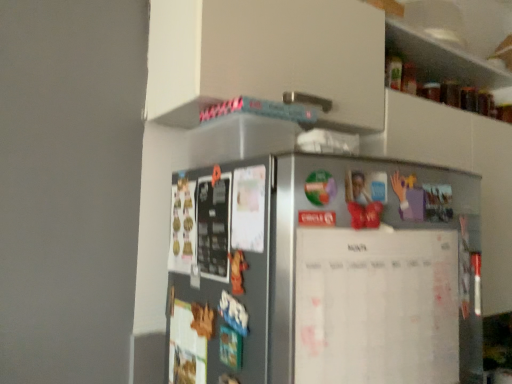
Question: From the image's perspective, would you say satin silver fridge at left is positioned over white paperboard at center?

Choices:
 (A) yes
 (B) no

Answer: (A)

Question: Is white paperboard at center at the back of satin silver fridge at left?

Choices:
 (A) yes
 (B) no

Answer: (A)

Question: Is satin silver fridge at left not within white paperboard at center?

Choices:
 (A) yes
 (B) no

Answer: (A)

Question: Is the depth of satin silver fridge at left less than that of white paperboard at center?

Choices:
 (A) no
 (B) yes

Answer: (B)

Question: Is white paperboard at center surrounded by satin silver fridge at left?

Choices:
 (A) no
 (B) yes

Answer: (A)

Question: Can you confirm if satin silver fridge at left is wider than white paperboard at center?

Choices:
 (A) yes
 (B) no

Answer: (A)

Question: Is the position of white paperboard at center less distant than that of satin silver fridge at left?

Choices:
 (A) yes
 (B) no

Answer: (B)

Question: Can you confirm if white paperboard at center is smaller than satin silver fridge at left?

Choices:
 (A) yes
 (B) no

Answer: (A)

Question: Is white paperboard at center wider than satin silver fridge at left?

Choices:
 (A) no
 (B) yes

Answer: (A)

Question: Is white paperboard at center at the left side of satin silver fridge at left?

Choices:
 (A) no
 (B) yes

Answer: (A)

Question: Considering the relative sizes of white paperboard at center and satin silver fridge at left in the image provided, is white paperboard at center thinner than satin silver fridge at left?

Choices:
 (A) yes
 (B) no

Answer: (A)

Question: Is satin silver fridge at left at the back of white paperboard at center?

Choices:
 (A) yes
 (B) no

Answer: (A)

Question: Is white paperboard at center wider or thinner than satin silver fridge at left?

Choices:
 (A) thin
 (B) wide

Answer: (A)